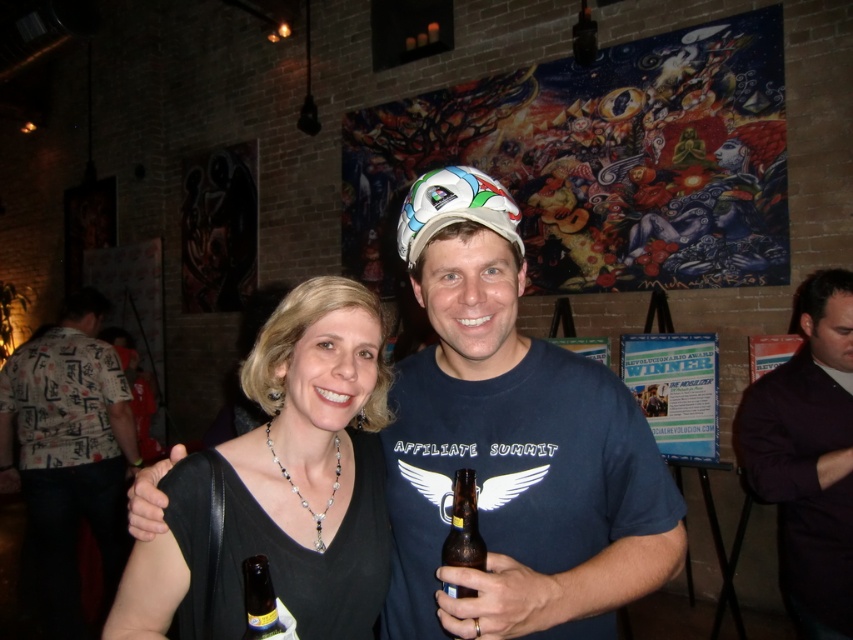
Can you confirm if black matte dress at center is positioned above white printed shirt at left?

Indeed, black matte dress at center is positioned over white printed shirt at left.

Is black matte dress at center to the right of white printed shirt at left from the viewer's perspective?

→ Yes, black matte dress at center is to the right of white printed shirt at left.

What are the coordinates of `black matte dress at center` in the screenshot? It's located at (311, 464).

Which is below, white printed shirt at left or brown glass bottle at center?

white printed shirt at left

Does white printed shirt at left have a lesser height compared to brown glass bottle at center?

Incorrect, white printed shirt at left's height does not fall short of brown glass bottle at center's.

This screenshot has height=640, width=853. In order to click on white printed shirt at left in this screenshot , I will do `click(68, 452)`.

Consider the image. Between white printed shirt at left and dark purple shirt at right, which one appears on the left side from the viewer's perspective?

white printed shirt at left is more to the left.

Which is in front, point (108, 500) or point (740, 401)?

Point (740, 401) is in front.

The image size is (853, 640). Identify the location of white printed shirt at left. pyautogui.click(x=68, y=452).